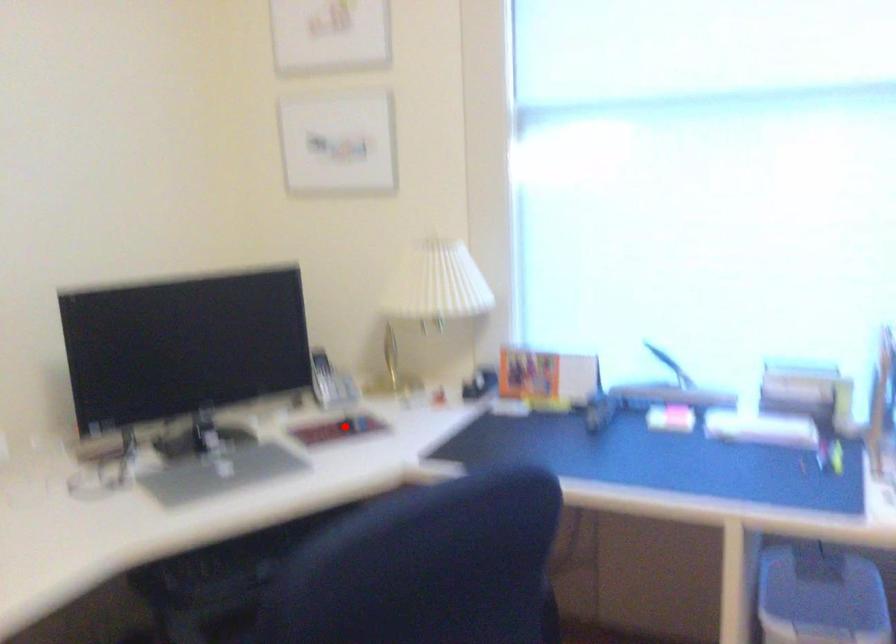
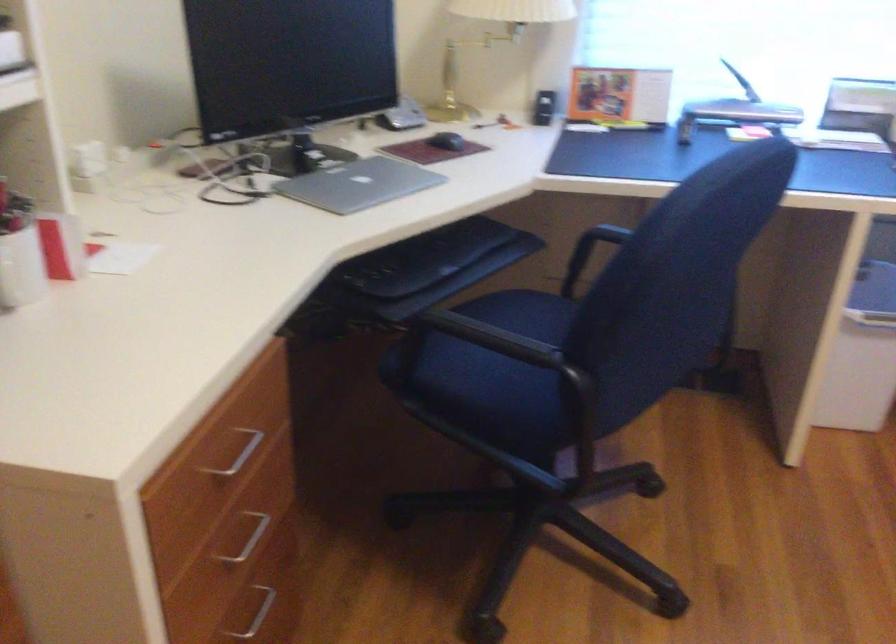
In the second image, find the point that corresponds to the highlighted location in the first image.

(446, 140)